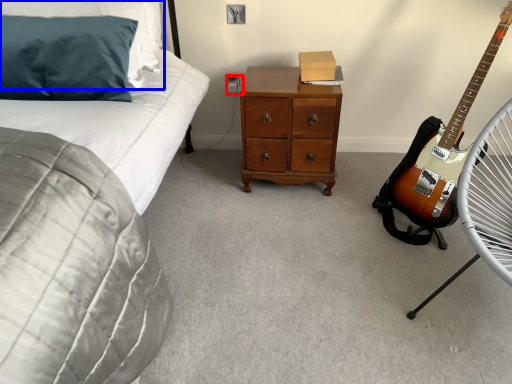
Question: Among these objects, which one is farthest to the camera, electric outlet (highlighted by a red box) or pillow (highlighted by a blue box)?

Choices:
 (A) electric outlet
 (B) pillow

Answer: (A)